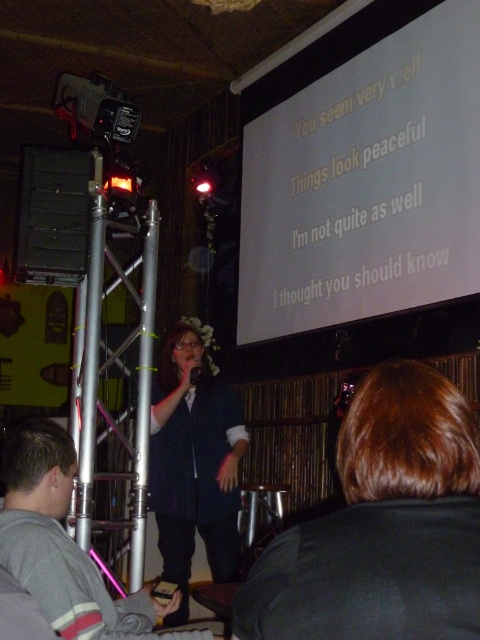
Describe the element at coordinates (365, 184) in the screenshot. The width and height of the screenshot is (480, 640). I see `white matte projection screen at upper center` at that location.

Is white matte projection screen at upper center wider than black matte speaker at left?

Indeed, white matte projection screen at upper center has a greater width compared to black matte speaker at left.

Does point (249, 209) come closer to viewer compared to point (40, 211)?

No, it is behind (40, 211).

Where is `white matte projection screen at upper center`? white matte projection screen at upper center is located at coordinates (365, 184).

Does black matte speaker at left appear on the right side of matte black microphone at center?

No, black matte speaker at left is not to the right of matte black microphone at center.

Locate an element on the screen. The width and height of the screenshot is (480, 640). black matte speaker at left is located at coordinates (52, 216).

Identify the location of black matte speaker at left. (52, 216).

Can you confirm if matte black vest at center is positioned to the right of gray fleece sweatshirt at lower left?

Yes, matte black vest at center is to the right of gray fleece sweatshirt at lower left.

Who is lower down, matte black vest at center or gray fleece sweatshirt at lower left?

Positioned lower is matte black vest at center.

What do you see at coordinates (193, 465) in the screenshot?
I see `matte black vest at center` at bounding box center [193, 465].

At what (x,y) coordinates should I click in order to perform the action: click on matte black vest at center. Please return your answer as a coordinate pair (x, y). The height and width of the screenshot is (640, 480). Looking at the image, I should click on (193, 465).